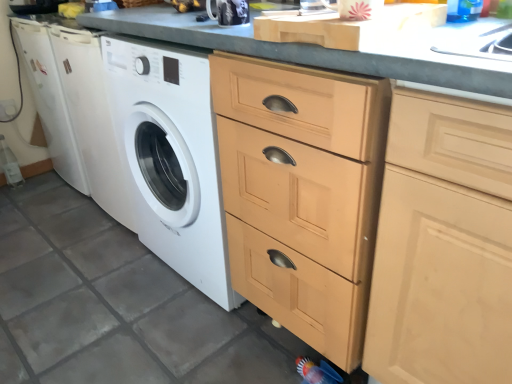
Question: From their relative heights in the image, would you say glossy ceramic mug at upper center is taller or shorter than light wood cabinet at center?

Choices:
 (A) tall
 (B) short

Answer: (B)

Question: From a real-world perspective, is glossy ceramic mug at upper center above or below light wood cabinet at center?

Choices:
 (A) below
 (B) above

Answer: (B)

Question: Is glossy ceramic mug at upper center wider or thinner than light wood cabinet at center?

Choices:
 (A) thin
 (B) wide

Answer: (A)

Question: Considering the positions of light wood cabinet at center and glossy ceramic mug at upper center in the image, is light wood cabinet at center taller or shorter than glossy ceramic mug at upper center?

Choices:
 (A) short
 (B) tall

Answer: (B)

Question: Is light wood cabinet at center spatially inside glossy ceramic mug at upper center, or outside of it?

Choices:
 (A) outside
 (B) inside

Answer: (A)

Question: Is light wood cabinet at center in front of or behind glossy ceramic mug at upper center in the image?

Choices:
 (A) front
 (B) behind

Answer: (A)

Question: In terms of width, does light wood cabinet at center look wider or thinner when compared to glossy ceramic mug at upper center?

Choices:
 (A) wide
 (B) thin

Answer: (A)